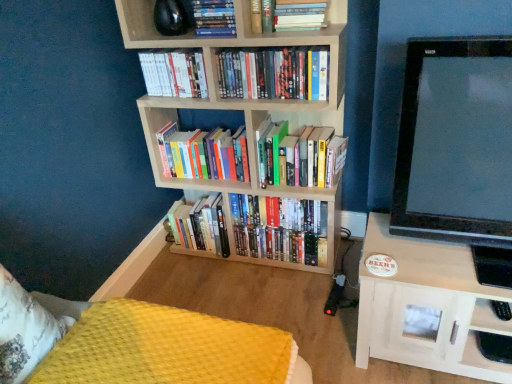
Question: Considering the positions of white wood shelf at right and white paperback book at upper left, arranged as the 3th book when viewed from the top, in the image, is white wood shelf at right taller or shorter than white paperback book at upper left, arranged as the 3th book when viewed from the top,?

Choices:
 (A) short
 (B) tall

Answer: (B)

Question: From the image's perspective, relative to white paperback book at upper left, arranged as the 3th book when viewed from the top, is white wood shelf at right above or below?

Choices:
 (A) below
 (B) above

Answer: (A)

Question: Based on their relative distances, which object is nearer to the hardcover books at upper center, which is the eighth book from bottom to top?

Choices:
 (A) light wood bookcase at center
 (B) hardcover books at center, placed as the fourth book when sorted from top to bottom
 (C) hardcover books at center, the first book ordered from the bottom
 (D) hardcover books at center, the 6th book viewed from the top
 (E) white wood shelf at right

Answer: (B)

Question: Which object is positioned farthest from the white wood shelf at right?

Choices:
 (A) hardcover books at center, which ranks as the 3th book in bottom-to-top order
 (B) hardcover books at center, the first book ordered from the bottom
 (C) hardcover books at center, placed as the fourth book when sorted from bottom to top
 (D) white paperback book at upper left, which ranks as the sixth book in bottom-to-top order
 (E) hardcover books at upper center, acting as the 1th book starting from the top

Answer: (E)